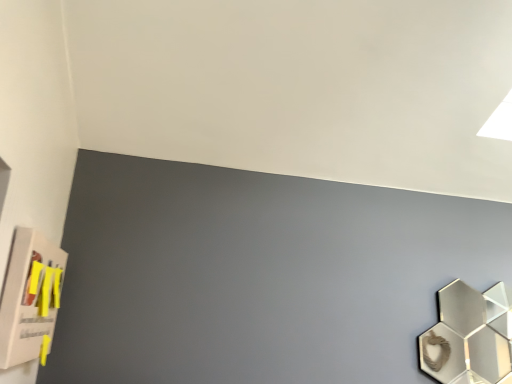
Measure the distance between wooden bulletin board at left and camera.

wooden bulletin board at left and camera are 35.31 inches apart.

Where is `wooden bulletin board at left`? wooden bulletin board at left is located at coordinates (30, 298).

What do you see at coordinates (30, 298) in the screenshot? I see `wooden bulletin board at left` at bounding box center [30, 298].

At what (x,y) coordinates should I click in order to perform the action: click on wooden bulletin board at left. Please return your answer as a coordinate pair (x, y). Looking at the image, I should click on (30, 298).